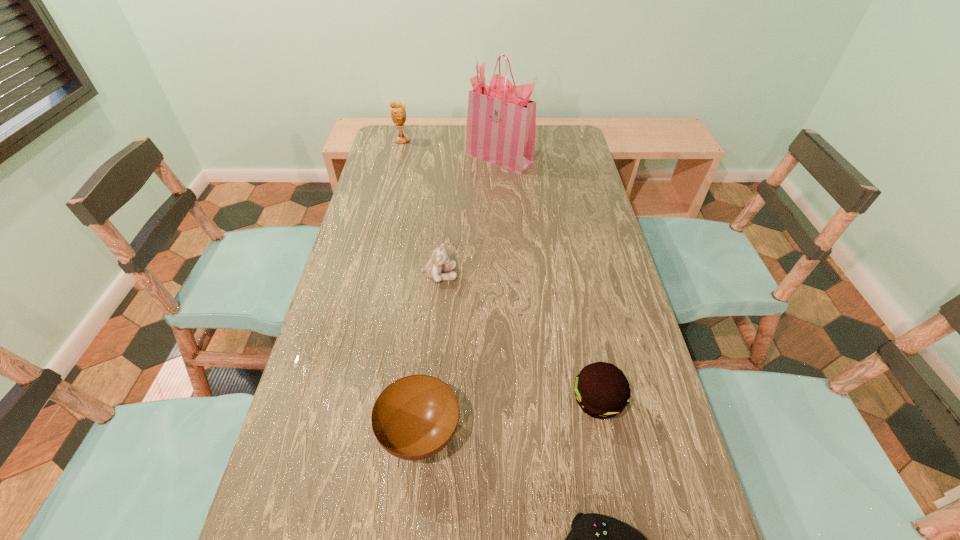
This screenshot has height=540, width=960. Identify the location of free region that satisfies the following two spatial constraints: 1. on the face of the teddy bear; 2. on the left side of the patty. (428, 401).

Where is `free location that satisfies the following two spatial constraints: 1. on the face of the teddy bear; 2. on the left side of the patty`? free location that satisfies the following two spatial constraints: 1. on the face of the teddy bear; 2. on the left side of the patty is located at coordinates (428, 401).

The width and height of the screenshot is (960, 540). Identify the location of free space that satisfies the following two spatial constraints: 1. on the face of the teddy bear; 2. on the left side of the patty. (428, 401).

Locate an element on the screen. Image resolution: width=960 pixels, height=540 pixels. vacant space that satisfies the following two spatial constraints: 1. on the back side of the patty; 2. on the face of the fourth nearest object is located at coordinates (572, 275).